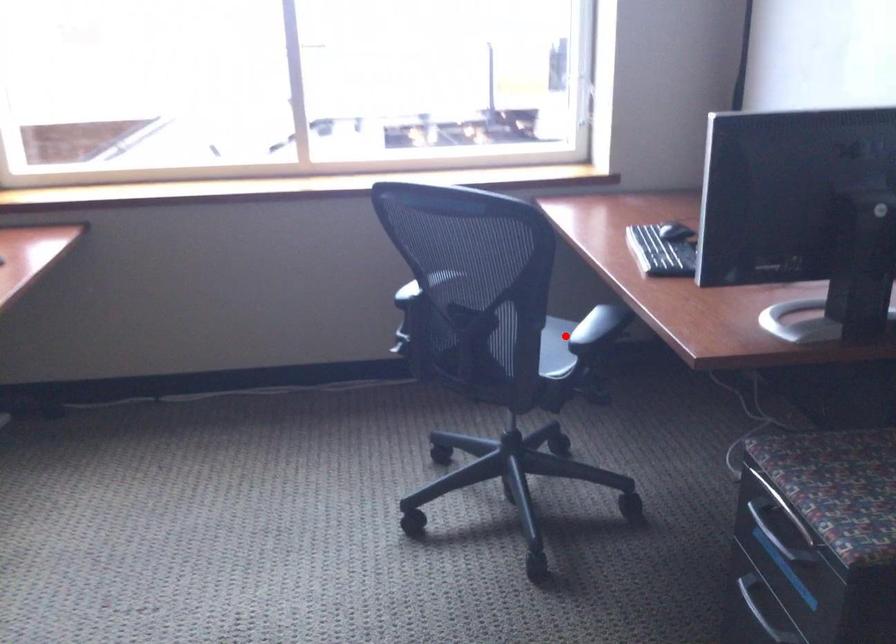
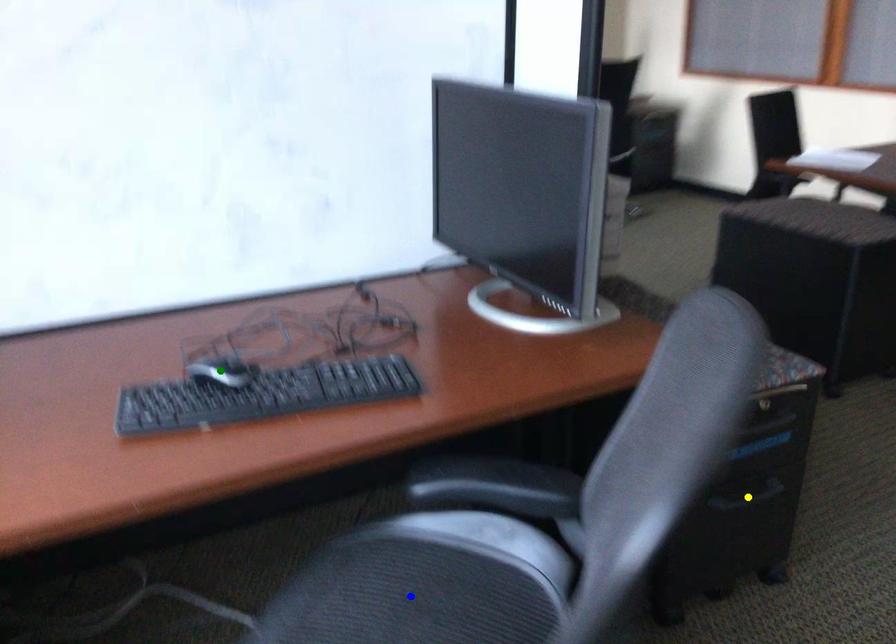
Question: I am providing you with two images of the same scene from different viewpoints. A red point is marked on the first image. You are given multiple points on the second image. Which point in image 2 is actually the same real-world point as the red point in image 1?

Choices:
 (A) green point
 (B) blue point
 (C) yellow point

Answer: (B)